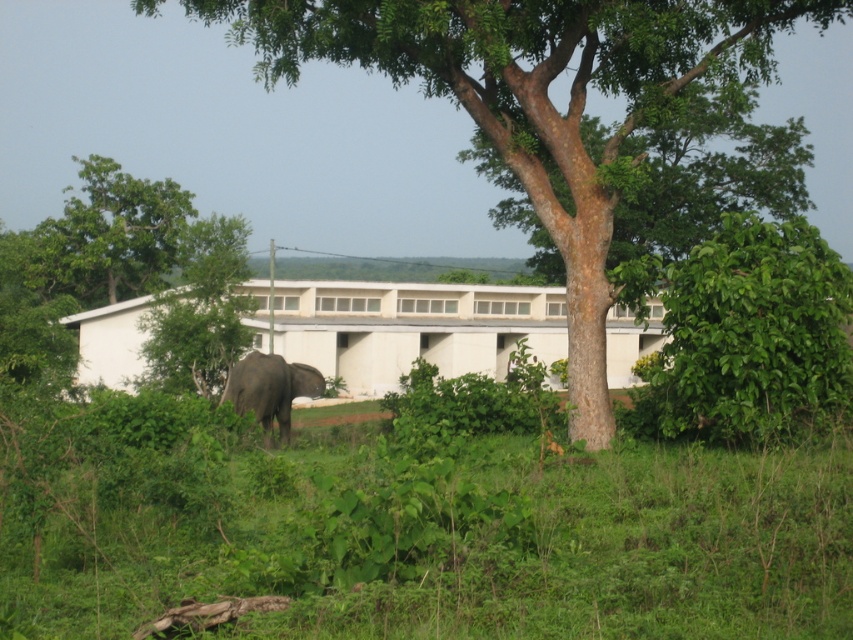
Which is more to the left, green leafy tree at upper left or gray matte elephant at center?

green leafy tree at upper left is more to the left.

Is green leafy tree at upper left bigger than gray matte elephant at center?

Correct, green leafy tree at upper left is larger in size than gray matte elephant at center.

Between point (39, 273) and point (306, 365), which one is positioned behind?

Positioned behind is point (39, 273).

Find the location of a particular element. This screenshot has height=640, width=853. green leafy tree at upper left is located at coordinates (109, 236).

Can you confirm if green leafy grass at lower center is bigger than brown rough tree at center?

Actually, green leafy grass at lower center might be smaller than brown rough tree at center.

Is green leafy grass at lower center to the left of brown rough tree at center from the viewer's perspective?

Indeed, green leafy grass at lower center is positioned on the left side of brown rough tree at center.

Does point (538, 612) come in front of point (308, 22)?

Yes, point (538, 612) is in front of point (308, 22).

Where is `green leafy grass at lower center`? green leafy grass at lower center is located at coordinates (415, 532).

Between point (585, 28) and point (279, 355), which one is positioned in front?

Point (585, 28)

Is brown rough tree at center below gray matte elephant at center?

Incorrect, brown rough tree at center is not positioned below gray matte elephant at center.

Is point (589, 36) farther from viewer compared to point (283, 433)?

That is False.

You are a GUI agent. You are given a task and a screenshot of the screen. Output one action in this format:
    pyautogui.click(x=<x>, y=<y>)
    Task: Click on the brown rough tree at center
    
    Given the screenshot: What is the action you would take?
    pyautogui.click(x=537, y=99)